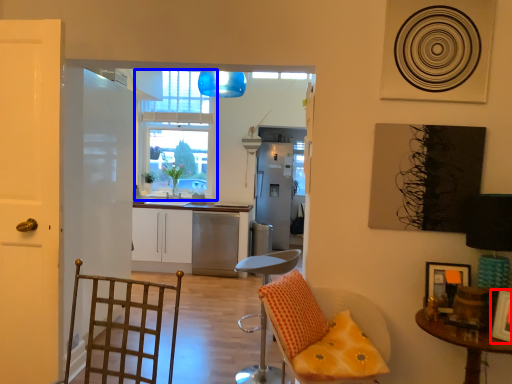
Question: Which object is further to the camera taking this photo, picture frame (highlighted by a red box) or window (highlighted by a blue box)?

Choices:
 (A) picture frame
 (B) window

Answer: (B)